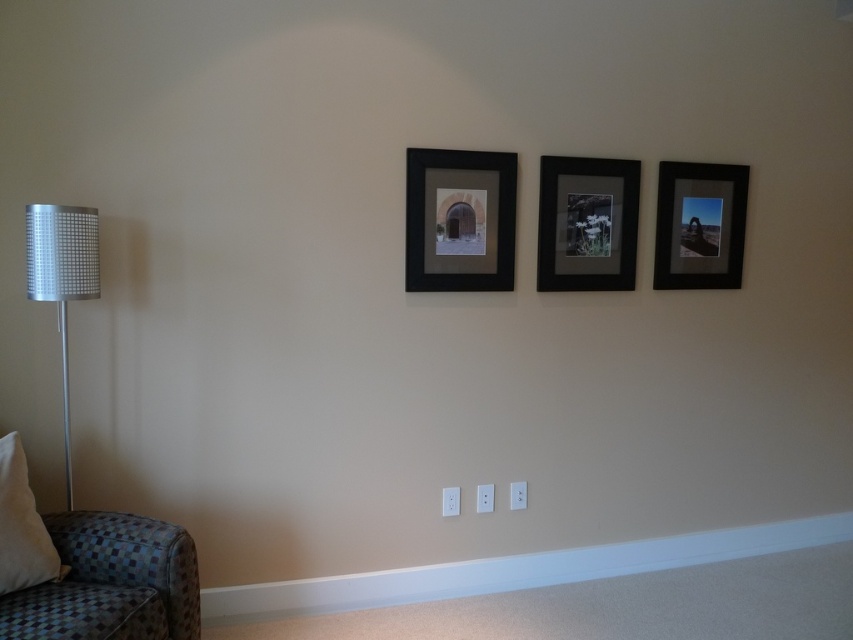
Is point (453, 241) closer to camera compared to point (585, 202)?

Yes, it is.

Between black matte picture frame at center and matte black picture frame at center, which one appears on the left side from the viewer's perspective?

From the viewer's perspective, black matte picture frame at center appears more on the left side.

Does point (492, 289) come closer to viewer compared to point (567, 160)?

That is True.

Locate an element on the screen. black matte picture frame at center is located at coordinates (459, 220).

Between matte black picture frame at upper right and silver/metallic floor lamp at left, which one has more height?

silver/metallic floor lamp at left

Does matte black picture frame at upper right have a greater width compared to silver/metallic floor lamp at left?

Yes, matte black picture frame at upper right is wider than silver/metallic floor lamp at left.

Who is more forward, (743, 227) or (32, 204)?

Point (32, 204) is more forward.

At what (x,y) coordinates should I click in order to perform the action: click on matte black picture frame at upper right. Please return your answer as a coordinate pair (x, y). Looking at the image, I should click on (699, 225).

Who is lower down, silver/metallic floor lamp at left or beige fabric pillow at lower left?

beige fabric pillow at lower left

Consider the image. Is silver/metallic floor lamp at left below beige fabric pillow at lower left?

No.

Describe the element at coordinates (62, 278) in the screenshot. I see `silver/metallic floor lamp at left` at that location.

Locate an element on the screen. silver/metallic floor lamp at left is located at coordinates (62, 278).